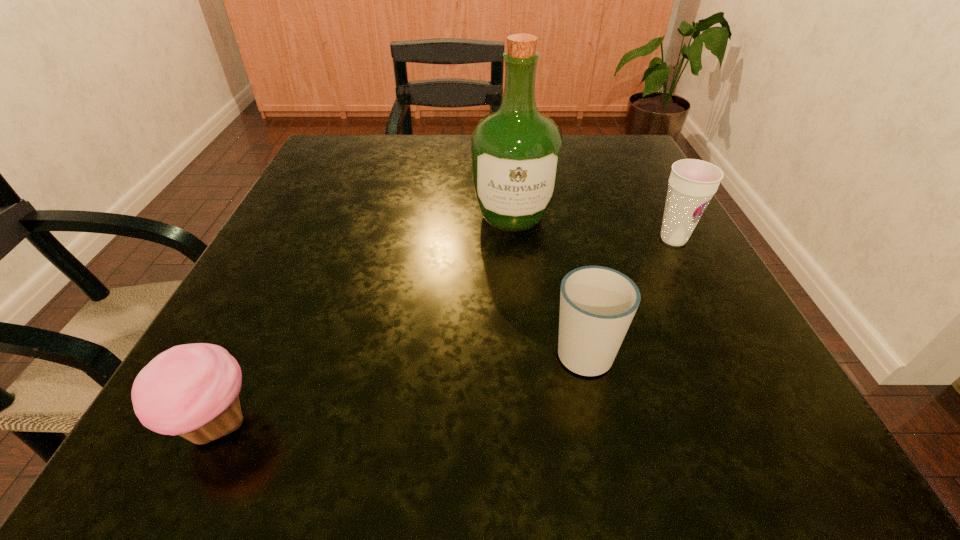
Identify the location of vacant space at the right edge. (608, 200).

This screenshot has height=540, width=960. In order to click on free space at the far left corner of the desktop in this screenshot , I will do coord(357,163).

Locate an element on the screen. The width and height of the screenshot is (960, 540). free space at the near left corner of the desktop is located at coordinates (258, 417).

At what (x,y) coordinates should I click in order to perform the action: click on free space at the far right corner of the desktop. Please return your answer as a coordinate pair (x, y). Looking at the image, I should click on pyautogui.click(x=572, y=150).

Where is `vacant space at the near right corner`? Image resolution: width=960 pixels, height=540 pixels. vacant space at the near right corner is located at coordinates (747, 431).

Where is `free space that is in between the liquor and the cupcake`? The image size is (960, 540). free space that is in between the liquor and the cupcake is located at coordinates (365, 320).

What are the coordinates of `free space that is in between the cupcake and the second nearest object` in the screenshot? It's located at (400, 387).

This screenshot has width=960, height=540. In order to click on vacant area that lies between the cupcake and the tallest object in this screenshot , I will do `click(365, 320)`.

Locate an element on the screen. free spot between the cupcake and the third farthest object is located at coordinates (400, 387).

I want to click on free area in between the cupcake and the liquor, so click(365, 320).